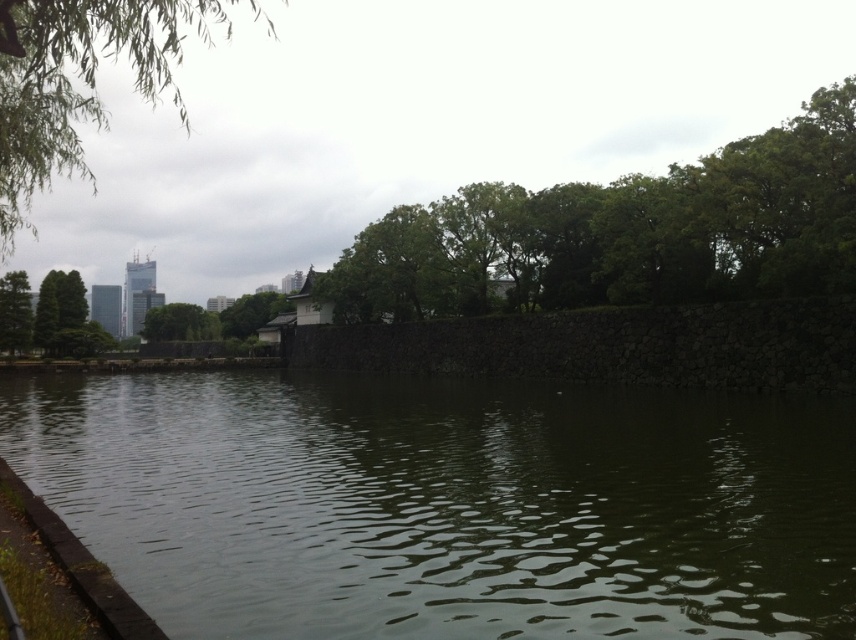
You are standing at the edge of the water and want to reach the point labeled as point (310, 634). Given that you can walk 30 feet before needing to rest, will you be able to reach that point without resting?

The distance between you and point (310, 634) is 25.33 feet, which is less than your 30 feet walking capacity. Therefore, you can reach the point without needing to rest.

You are standing at the point closest to the water in the scene. Which of the two points, point (31, 163) or point (169, 333), is closer to you?

Point (31, 163) is in front of point (169, 333), so it is closer to you.